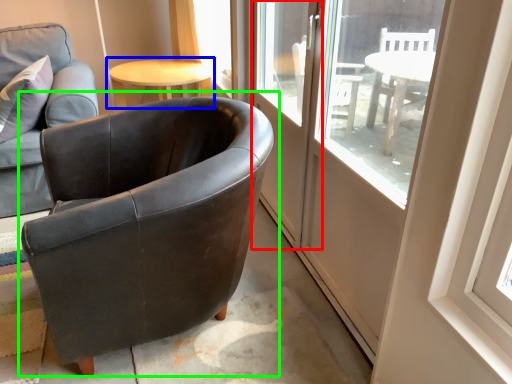
Question: Based on their relative distances, which object is nearer to screen door (highlighted by a red box)? Choose from table (highlighted by a blue box) and chair (highlighted by a green box).

Choices:
 (A) table
 (B) chair

Answer: (B)